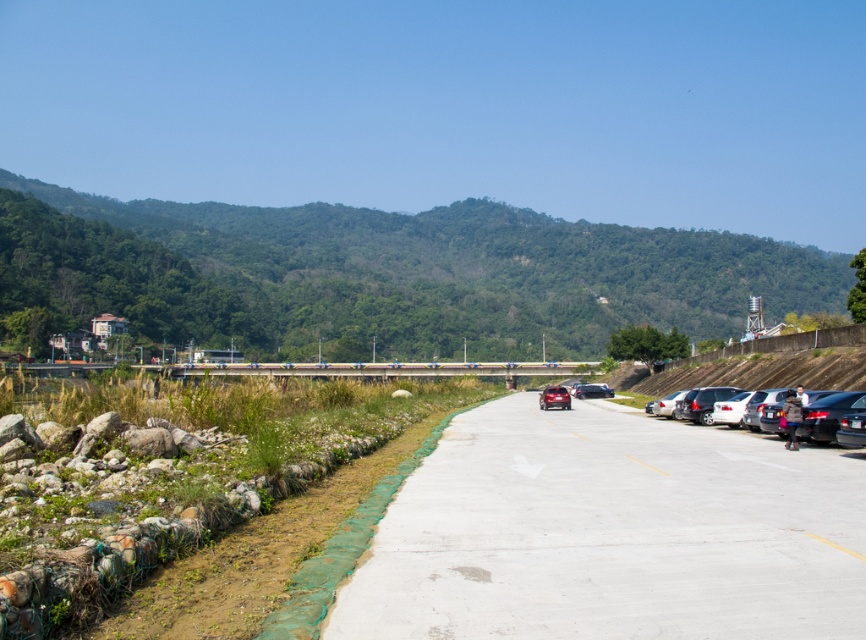
Can you confirm if white glossy sedan at right is taller than satin silver sedan at lower right?

Incorrect, white glossy sedan at right's height is not larger of satin silver sedan at lower right's.

Is white glossy sedan at right smaller than satin silver sedan at lower right?

Yes, white glossy sedan at right is smaller than satin silver sedan at lower right.

Find the location of a particular element. Image resolution: width=866 pixels, height=640 pixels. white glossy sedan at right is located at coordinates (729, 408).

Image resolution: width=866 pixels, height=640 pixels. What are the coordinates of `white glossy sedan at right` in the screenshot? It's located at (729, 408).

Is smooth asphalt road at center positioned in front of green leafy hillside at upper center?

Yes, it is in front of green leafy hillside at upper center.

You are a GUI agent. You are given a task and a screenshot of the screen. Output one action in this format:
    pyautogui.click(x=<x>, y=<y>)
    Task: Click on the smooth asphalt road at center
    
    Given the screenshot: What is the action you would take?
    pyautogui.click(x=611, y=532)

Is satin silver sedan at lower right taller than shiny black car at center?

Yes, satin silver sedan at lower right is taller than shiny black car at center.

The width and height of the screenshot is (866, 640). What do you see at coordinates (664, 404) in the screenshot?
I see `satin silver sedan at lower right` at bounding box center [664, 404].

Is point (657, 401) positioned after point (600, 394)?

No, it is in front of (600, 394).

Where is `satin silver sedan at lower right`? Image resolution: width=866 pixels, height=640 pixels. satin silver sedan at lower right is located at coordinates (664, 404).